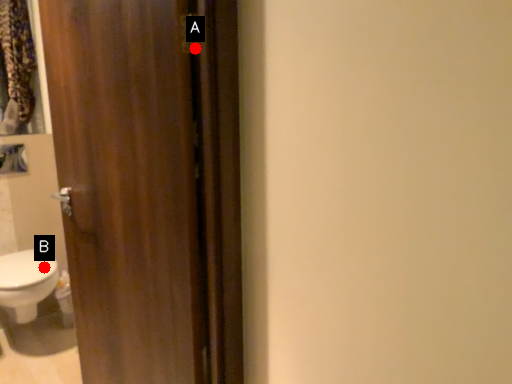
Question: Two points are circled on the image, labeled by A and B beside each circle. Which point is closer to the camera?

Choices:
 (A) A is closer
 (B) B is closer

Answer: (A)